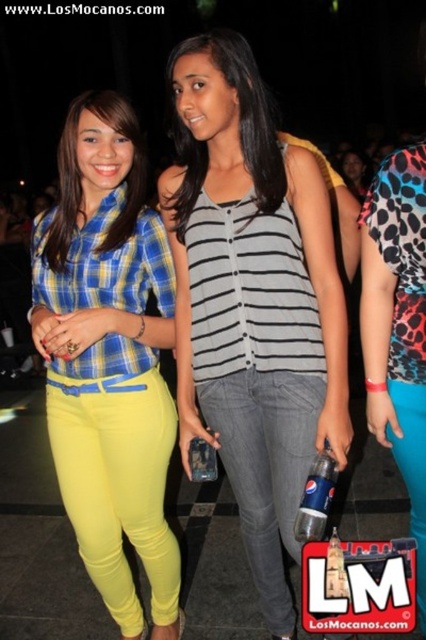
Who is more distant from viewer, (123, 179) or (417, 488)?

The point (123, 179) is more distant.

Is plaid fabric shirt at center behind teal satin skirt at lower right?

Yes.

Which is in front, point (141, 184) or point (417, 452)?

Point (417, 452) is more forward.

Locate an element on the screen. The image size is (426, 640). plaid fabric shirt at center is located at coordinates (80, 176).

Consider the image. Is the position of matte yellow pants at lower left more distant than that of leopard print dress at right?

Yes.

Does point (167, 412) come farther from viewer compared to point (405, 282)?

Yes, point (167, 412) is farther from viewer.

The width and height of the screenshot is (426, 640). I want to click on matte yellow pants at lower left, so click(118, 484).

Measure the distance between point (x=230, y=44) and camera.

A distance of 1.65 meters exists between point (x=230, y=44) and camera.

Does striped fabric top at center have a lesser height compared to plaid fabric shirt at center?

In fact, striped fabric top at center may be taller than plaid fabric shirt at center.

Locate an element on the screen. The width and height of the screenshot is (426, 640). striped fabric top at center is located at coordinates (238, 125).

The image size is (426, 640). Identify the location of striped fabric top at center. (238, 125).